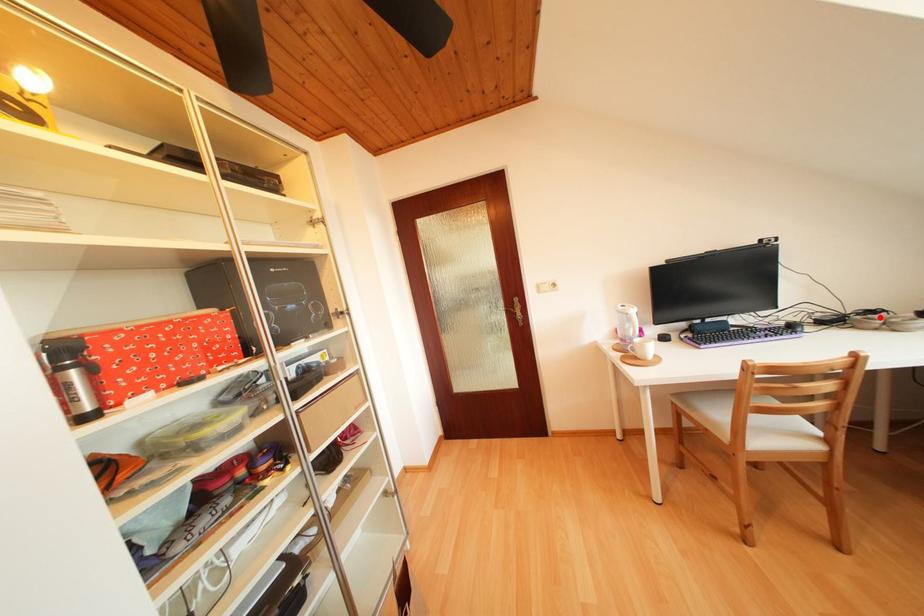
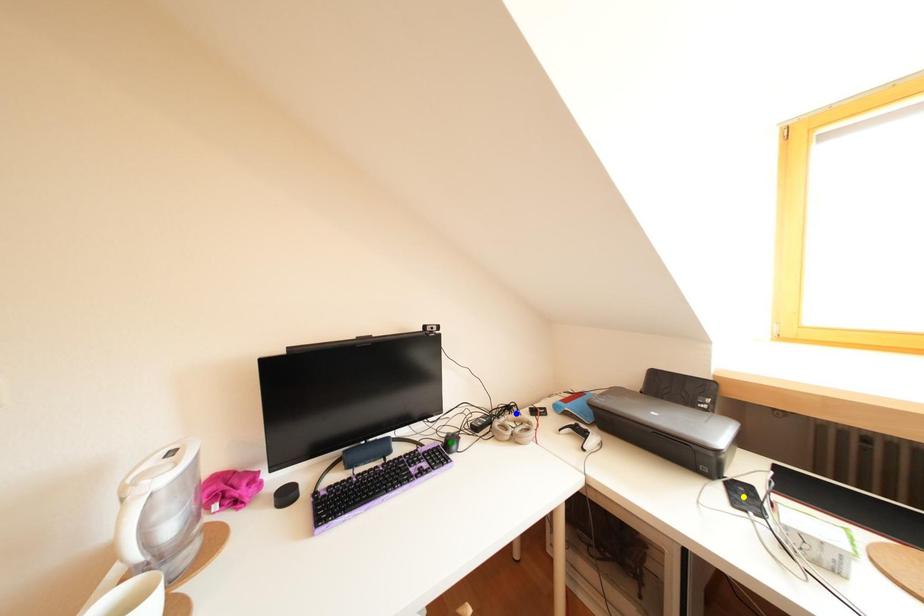
Question: I am providing you with two images of the same scene from different viewpoints. A red point is marked on the first image. You are given multiple points on the second image. Can you choose the point in image 2 that corresponds to the point in image 1?

Choices:
 (A) green point
 (B) blue point
 (C) yellow point

Answer: (B)